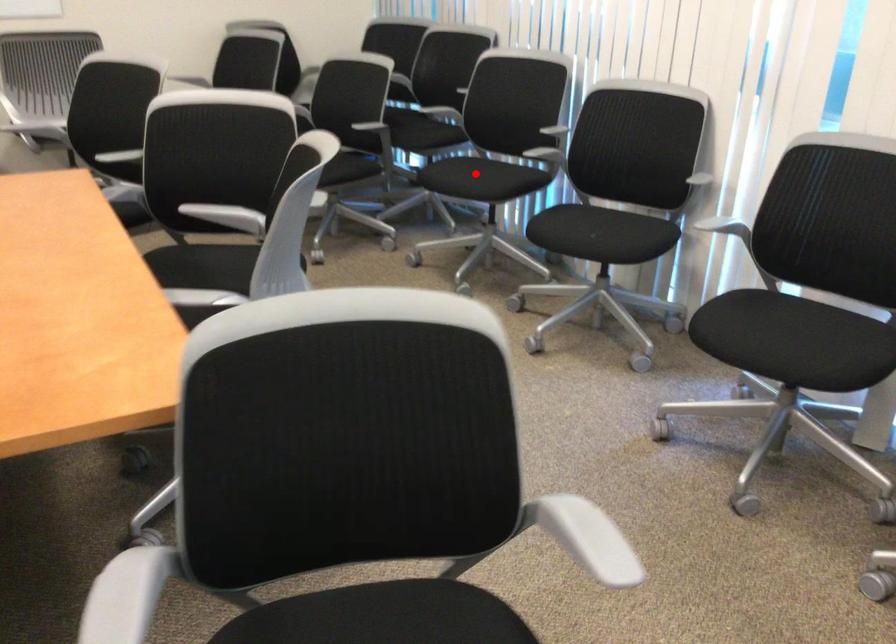
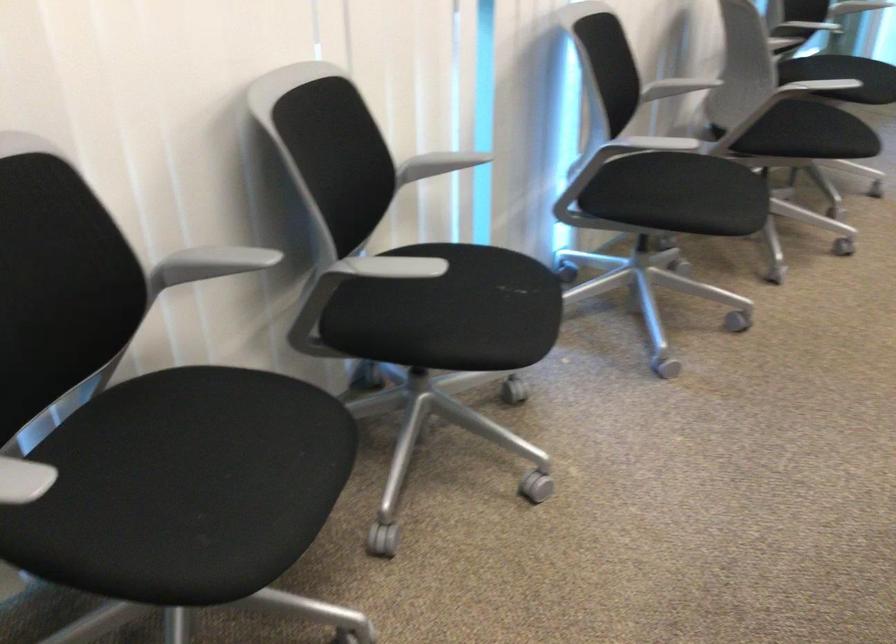
Where in the second image is the point corresponding to the highlighted location from the first image?

(226, 456)